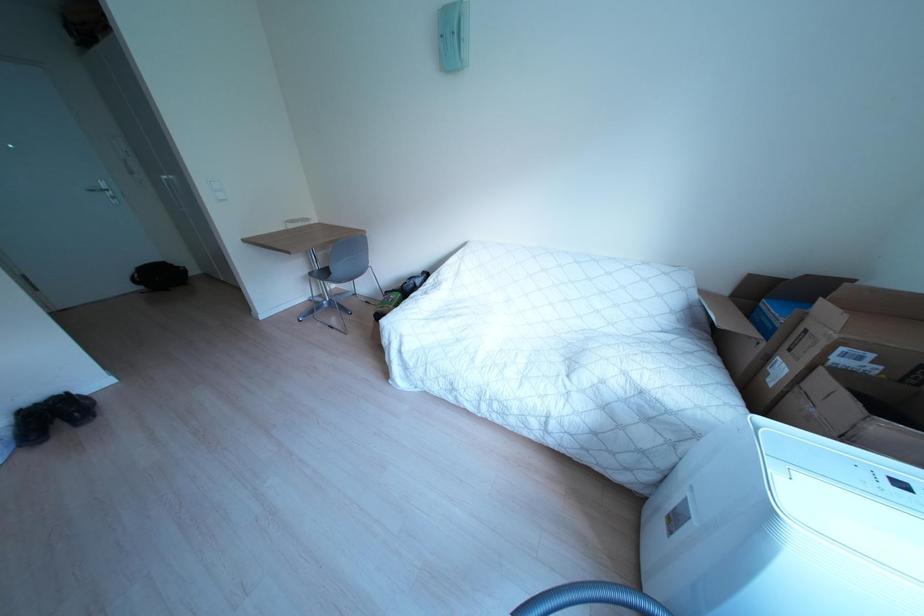
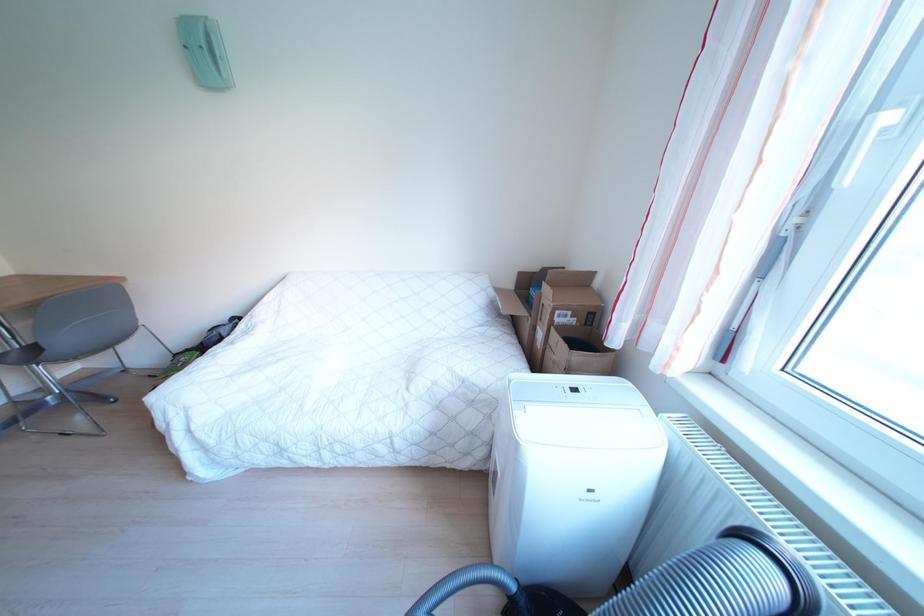
Question: The images are taken continuously from a first-person perspective. In which direction is your viewpoint rotating?

Choices:
 (A) Left
 (B) Right
 (C) Up
 (D) Down

Answer: (B)